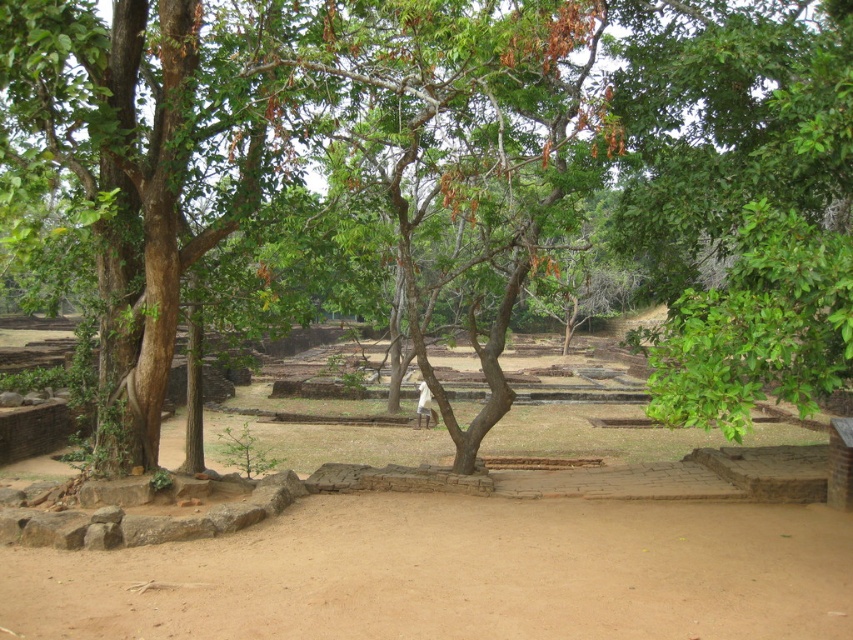
You are a gardener planning to plant a row of flowers along the dirt fields. The recommended spacing between flower plants is 1 foot. How many flower plants can you place between the brown dirt field at center and the brown dirt field at lower center?

The distance between the brown dirt field at center and brown dirt field at lower center is 7.27 feet. Since each flower plant requires 1 foot of space, you can plant 7 flower plants between them, as 7.27 feet divided by 1 foot per plant equals approximately 7 plants.

You are standing at the entrance of the archaeological site and want to locate the brown dirt field at center. According to the coordinates provided, where should you look to find it?

The brown dirt field at center is located at coordinates point (467, 568), so you should look towards the center of the image slightly towards the right and middle to find it.